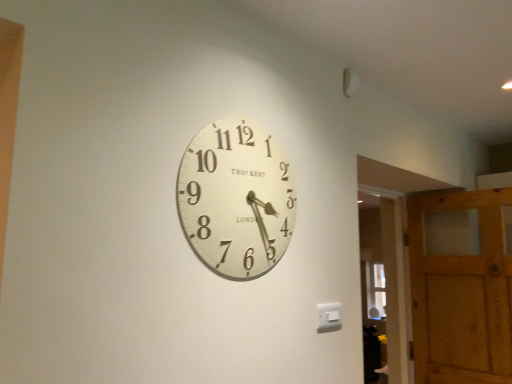
Question: Is the surface of transparent glass door at right in direct contact with white matte clock at center?

Choices:
 (A) no
 (B) yes

Answer: (A)

Question: From the image's perspective, is transparent glass door at right located above white matte clock at center?

Choices:
 (A) no
 (B) yes

Answer: (A)

Question: Does transparent glass door at right have a larger size compared to white matte clock at center?

Choices:
 (A) no
 (B) yes

Answer: (B)

Question: Can you confirm if transparent glass door at right is positioned to the right of white matte clock at center?

Choices:
 (A) yes
 (B) no

Answer: (A)

Question: Does transparent glass door at right have a smaller size compared to white matte clock at center?

Choices:
 (A) yes
 (B) no

Answer: (B)

Question: Considering the relative sizes of transparent glass door at right and white matte clock at center in the image provided, is transparent glass door at right shorter than white matte clock at center?

Choices:
 (A) no
 (B) yes

Answer: (A)

Question: Is transparent glass door at right to the right of wooden barn door at right from the viewer's perspective?

Choices:
 (A) no
 (B) yes

Answer: (A)

Question: Is transparent glass door at right to the left of wooden barn door at right from the viewer's perspective?

Choices:
 (A) yes
 (B) no

Answer: (A)

Question: Is transparent glass door at right shorter than wooden barn door at right?

Choices:
 (A) yes
 (B) no

Answer: (B)

Question: Does transparent glass door at right have a larger size compared to wooden barn door at right?

Choices:
 (A) no
 (B) yes

Answer: (A)

Question: From the image's perspective, would you say transparent glass door at right is shown under wooden barn door at right?

Choices:
 (A) yes
 (B) no

Answer: (B)

Question: From the image's perspective, is transparent glass door at right on top of wooden barn door at right?

Choices:
 (A) no
 (B) yes

Answer: (B)

Question: Is white matte clock at center positioned far away from transparent glass door at right?

Choices:
 (A) no
 (B) yes

Answer: (B)